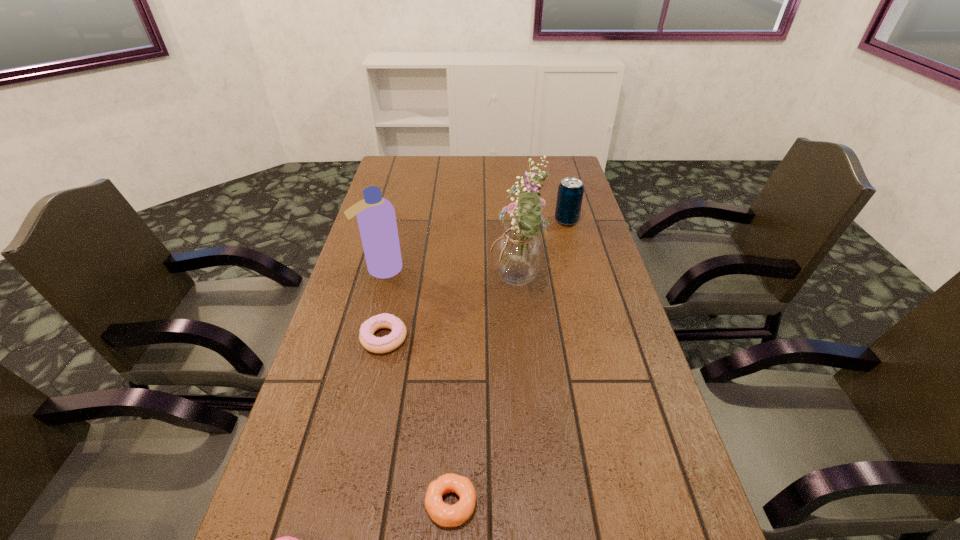
The image size is (960, 540). What are the coordinates of `vacant space positioned on the front-facing side of the tallest object` in the screenshot? It's located at (446, 285).

This screenshot has width=960, height=540. Identify the location of vacant space positioned 0.210m on the front of the fifth shortest object. (363, 339).

In order to click on blank area located 0.360m on the left of the rightmost object in this screenshot , I will do tap(445, 221).

Find the location of `free space located 0.260m on the right of the third nearest object`. free space located 0.260m on the right of the third nearest object is located at coordinates click(x=514, y=338).

Find the location of `free space located 0.130m on the right of the second nearest doughnut`. free space located 0.130m on the right of the second nearest doughnut is located at coordinates (550, 503).

This screenshot has width=960, height=540. Identify the location of shampoo that is positioned at the left edge. click(x=376, y=218).

The width and height of the screenshot is (960, 540). What are the coordinates of `doughnut that is positioned at the left edge` in the screenshot? It's located at (390, 342).

Locate an element on the screen. object situated at the right edge is located at coordinates (570, 191).

Find the location of a particular element. This screenshot has height=540, width=960. vacant space at the far edge is located at coordinates (445, 171).

Image resolution: width=960 pixels, height=540 pixels. I want to click on free space at the left edge of the desktop, so click(276, 484).